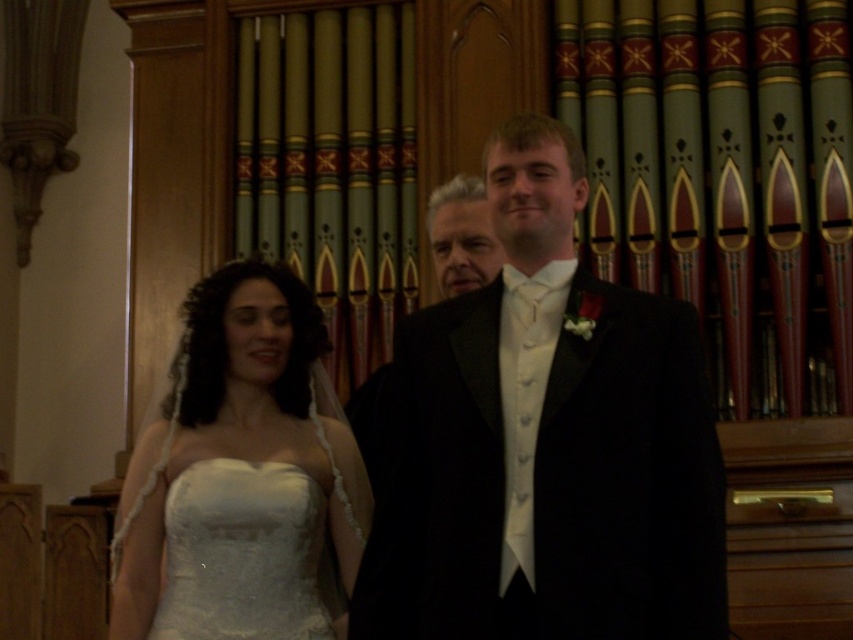
Question: Which point is closer to the camera taking this photo?

Choices:
 (A) pos(212,608)
 (B) pos(274,573)

Answer: (A)

Question: Is velvet black suit at center to the left of smooth black suit at center from the viewer's perspective?

Choices:
 (A) no
 (B) yes

Answer: (A)

Question: Which object is positioned closest to the white satin dress at center?

Choices:
 (A) white satin dress at lower left
 (B) smooth black suit at center

Answer: (A)

Question: Is white satin dress at lower left bigger than smooth black suit at center?

Choices:
 (A) no
 (B) yes

Answer: (B)

Question: Considering the relative positions of velvet black suit at center and white satin dress at center in the image provided, where is velvet black suit at center located with respect to white satin dress at center?

Choices:
 (A) left
 (B) right

Answer: (B)

Question: Which of the following is the closest to the observer?

Choices:
 (A) velvet black suit at center
 (B) white satin dress at lower left

Answer: (A)